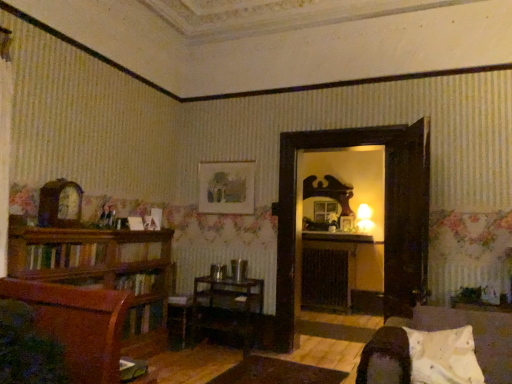
Question: From a real-world perspective, is black matte fireplace at center below matte paper picture frame at upper center?

Choices:
 (A) no
 (B) yes

Answer: (B)

Question: Is black matte fireplace at center taller than matte paper picture frame at upper center?

Choices:
 (A) no
 (B) yes

Answer: (B)

Question: Is black matte fireplace at center positioned with its back to matte paper picture frame at upper center?

Choices:
 (A) no
 (B) yes

Answer: (A)

Question: Is black matte fireplace at center in contact with matte paper picture frame at upper center?

Choices:
 (A) yes
 (B) no

Answer: (B)

Question: Considering the relative sizes of black matte fireplace at center and matte paper picture frame at upper center in the image provided, is black matte fireplace at center wider than matte paper picture frame at upper center?

Choices:
 (A) no
 (B) yes

Answer: (B)

Question: Considering the relative sizes of black matte fireplace at center and matte paper picture frame at upper center in the image provided, is black matte fireplace at center smaller than matte paper picture frame at upper center?

Choices:
 (A) no
 (B) yes

Answer: (A)

Question: Does black matte fireplace at center turn towards white soft pillow at lower right?

Choices:
 (A) no
 (B) yes

Answer: (B)

Question: Is black matte fireplace at center to the left of white soft pillow at lower right from the viewer's perspective?

Choices:
 (A) yes
 (B) no

Answer: (B)

Question: Is white soft pillow at lower right located within black matte fireplace at center?

Choices:
 (A) yes
 (B) no

Answer: (B)

Question: From the image's perspective, would you say black matte fireplace at center is positioned over white soft pillow at lower right?

Choices:
 (A) no
 (B) yes

Answer: (A)

Question: Is black matte fireplace at center outside white soft pillow at lower right?

Choices:
 (A) yes
 (B) no

Answer: (A)

Question: Is black matte fireplace at center further to camera compared to white soft pillow at lower right?

Choices:
 (A) yes
 (B) no

Answer: (A)

Question: Is white soft pillow at lower right shorter than black matte fireplace at center?

Choices:
 (A) yes
 (B) no

Answer: (A)